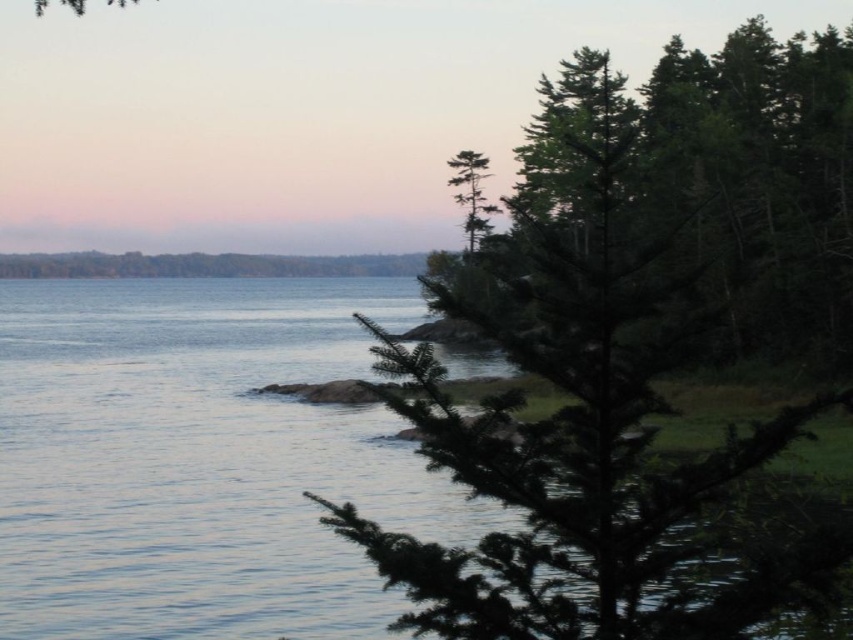
Question: Among these objects, which one is farthest from the camera?

Choices:
 (A) clear water at center
 (B) green needle-like tree at center

Answer: (A)

Question: Observing the image, what is the correct spatial positioning of green needle-like tree at center in reference to green needle-like tree at upper center?

Choices:
 (A) left
 (B) right

Answer: (B)

Question: Which is nearer to the green needle-like tree at upper center?

Choices:
 (A) green needle-like tree at center
 (B) clear water at center

Answer: (B)

Question: Is green needle-like tree at center positioned in front of green needle-like tree at upper center?

Choices:
 (A) no
 (B) yes

Answer: (B)

Question: Among these points, which one is nearest to the camera?

Choices:
 (A) 337,532
 (B) 16,403
 (C) 483,160

Answer: (A)

Question: Is clear water at center smaller than green needle-like tree at upper center?

Choices:
 (A) yes
 (B) no

Answer: (B)